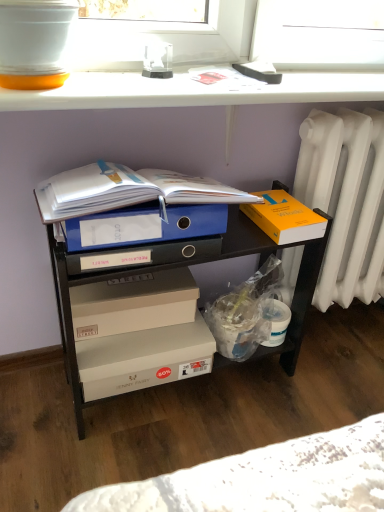
Find the location of a particular element. The width and height of the screenshot is (384, 512). blue plastic file at center is located at coordinates (137, 156).

What is the approximate height of orange matte book at right, which is the 1th box in top-to-bottom order?

orange matte book at right, which is the 1th box in top-to-bottom order, is 2.44 inches tall.

Find the location of a particular element. The height and width of the screenshot is (512, 384). white glossy window sill at upper center is located at coordinates (193, 91).

Is the depth of beige cardboard box at center, the second box from the top, greater than that of white plastic radiator at right?

Yes, beige cardboard box at center, the second box from the top, is further from the viewer.

From the image's perspective, which object appears higher, beige cardboard box at center, positioned as the 2th box in bottom-to-top order, or white plastic radiator at right?

white plastic radiator at right.

Considering the sizes of objects beige cardboard box at center, the second box from the top, and white plastic radiator at right in the image provided, who is bigger, beige cardboard box at center, the second box from the top, or white plastic radiator at right?

With larger size is white plastic radiator at right.

Where is `radiator located in front of the beige cardboard box at center, positioned as the 2th box in bottom-to-top order`? radiator located in front of the beige cardboard box at center, positioned as the 2th box in bottom-to-top order is located at coordinates point(346,200).

Is orange matte book at right, the third box positioned from the bottom, at the left side of beige cardboard box at center, the second box from the top?

In fact, orange matte book at right, the third box positioned from the bottom, is to the right of beige cardboard box at center, the second box from the top.

Considering the points (286, 206) and (173, 305), which point is behind, point (286, 206) or point (173, 305)?

The point (286, 206) is behind.

Identify the location of box above the beige cardboard box at center, positioned as the 2th box in bottom-to-top order (from the image's perspective). 285,218.

From a real-world perspective, is orange matte book at right, the third box positioned from the bottom, positioned over beige cardboard box at center, the second box from the top, based on gravity?

Yes, from a real-world perspective, orange matte book at right, the third box positioned from the bottom, is on top of beige cardboard box at center, the second box from the top.

Does white plastic radiator at right appear on the right side of white cardboard box at center, which is the third box from top to bottom?

Correct, you'll find white plastic radiator at right to the right of white cardboard box at center, which is the third box from top to bottom.

Is white plastic radiator at right touching white cardboard box at center, which is the third box from top to bottom?

No.

Between white plastic radiator at right and white cardboard box at center, which appears as the first box when ordered from the bottom, which one has less height?

With less height is white cardboard box at center, which appears as the first box when ordered from the bottom.

Is point (318, 221) closer to camera compared to point (116, 394)?

That is True.

Is orange matte book at right, which is the 1th box in top-to-bottom order, facing away from white cardboard box at center, which is the third box from top to bottom?

No, white cardboard box at center, which is the third box from top to bottom, is not at the back of orange matte book at right, which is the 1th box in top-to-bottom order.

Between orange matte book at right, the third box positioned from the bottom, and white cardboard box at center, which is the third box from top to bottom, which one has larger size?

white cardboard box at center, which is the third box from top to bottom, is bigger.

Between orange matte book at right, the third box positioned from the bottom, and white cardboard box at center, which appears as the first box when ordered from the bottom, which one has less height?

orange matte book at right, the third box positioned from the bottom, is shorter.

Based on the photo, which is farther from the camera, (37, 252) or (293, 217)?

The point (37, 252) is farther from the camera.

Between blue plastic file at center and orange matte book at right, which is the 1th box in top-to-bottom order, which one is positioned in front?

blue plastic file at center.

Do you think blue plastic file at center is within orange matte book at right, which is the 1th box in top-to-bottom order, or outside of it?

blue plastic file at center is spatially situated outside orange matte book at right, which is the 1th box in top-to-bottom order.

Looking at their sizes, would you say blue plastic file at center is wider or thinner than orange matte book at right, which is the 1th box in top-to-bottom order?

In the image, blue plastic file at center appears to be wider than orange matte book at right, which is the 1th box in top-to-bottom order.

From the image's perspective, which is above, white plastic radiator at right or orange matte book at right, which is the 1th box in top-to-bottom order?

orange matte book at right, which is the 1th box in top-to-bottom order.

Relative to orange matte book at right, which is the 1th box in top-to-bottom order, is white plastic radiator at right in front or behind?

white plastic radiator at right is behind orange matte book at right, which is the 1th box in top-to-bottom order.

How distant is white plastic radiator at right from orange matte book at right, the third box positioned from the bottom?

The distance of white plastic radiator at right from orange matte book at right, the third box positioned from the bottom, is 8.18 inches.

Is white plastic radiator at right spatially inside orange matte book at right, the third box positioned from the bottom, or outside of it?

white plastic radiator at right is located beyond the bounds of orange matte book at right, the third box positioned from the bottom.

Would you consider white cardboard box at center, which appears as the first box when ordered from the bottom, to be distant from white plastic radiator at right?

No, white cardboard box at center, which appears as the first box when ordered from the bottom, is in close proximity to white plastic radiator at right.

In terms of size, does white cardboard box at center, which is the third box from top to bottom, appear bigger or smaller than white plastic radiator at right?

In the image, white cardboard box at center, which is the third box from top to bottom, appears to be smaller than white plastic radiator at right.

From the image's perspective, which one is positioned higher, white cardboard box at center, which is the third box from top to bottom, or white plastic radiator at right?

white plastic radiator at right is shown above in the image.

Which point is more forward, (159, 376) or (301, 165)?

The point (159, 376) is closer to the camera.

You are a GUI agent. You are given a task and a screenshot of the screen. Output one action in this format:
    pyautogui.click(x=<x>, y=<y>)
    Task: Click on the radiator in front of the beige cardboard box at center, the second box from the top
    The image size is (384, 512).
    Given the screenshot: What is the action you would take?
    pyautogui.click(x=346, y=200)

Identify the location of box that is behind the orange matte book at right, which is the 1th box in top-to-bottom order. This screenshot has width=384, height=512. (133, 303).

From the image, which object appears to be nearer to white cardboard box at center, which appears as the first box when ordered from the bottom, white plastic radiator at right or beige cardboard box at center, positioned as the 2th box in bottom-to-top order?

Among the two, beige cardboard box at center, positioned as the 2th box in bottom-to-top order, is located nearer to white cardboard box at center, which appears as the first box when ordered from the bottom.

Considering their positions, is white glossy window sill at upper center positioned closer to white plastic radiator at right than blue plastic file at center?

blue plastic file at center is closer to white plastic radiator at right.

Based on their spatial positions, is white plastic radiator at right or orange matte book at right, which is the 1th box in top-to-bottom order, further from beige cardboard box at center, positioned as the 2th box in bottom-to-top order?

Based on the image, white plastic radiator at right appears to be further to beige cardboard box at center, positioned as the 2th box in bottom-to-top order.

Which object lies nearer to the anchor point white plastic radiator at right, blue plastic file at center or white glossy window sill at upper center?

blue plastic file at center is positioned closer to the anchor white plastic radiator at right.

Based on their spatial positions, is white glossy window sill at upper center or white plastic radiator at right closer to beige cardboard box at center, positioned as the 2th box in bottom-to-top order?

white glossy window sill at upper center is closer to beige cardboard box at center, positioned as the 2th box in bottom-to-top order.

From the image, which object appears to be farther from beige cardboard box at center, the second box from the top, white cardboard box at center, which appears as the first box when ordered from the bottom, or blue plastic file at center?

blue plastic file at center is further to beige cardboard box at center, the second box from the top.

Based on their spatial positions, is white glossy window sill at upper center or white plastic radiator at right further from white cardboard box at center, which appears as the first box when ordered from the bottom?

The object further to white cardboard box at center, which appears as the first box when ordered from the bottom, is white glossy window sill at upper center.

Based on their spatial positions, is beige cardboard box at center, the second box from the top, or white glossy window sill at upper center further from blue plastic file at center?

beige cardboard box at center, the second box from the top, lies further to blue plastic file at center than the other object.

Locate an element on the screen. Image resolution: width=384 pixels, height=512 pixels. window sill between white cardboard box at center, which appears as the first box when ordered from the bottom, and white plastic radiator at right, in the horizontal direction is located at coordinates coord(193,91).

Locate an element on the screen. Image resolution: width=384 pixels, height=512 pixels. desk between white cardboard box at center, which is the third box from top to bottom, and white plastic radiator at right, in the horizontal direction is located at coordinates (137, 156).

Locate an element on the screen. Image resolution: width=384 pixels, height=512 pixels. box between blue plastic file at center and white plastic radiator at right in the horizontal direction is located at coordinates (285, 218).

At what (x,y) coordinates should I click in order to perform the action: click on desk between white cardboard box at center, which appears as the first box when ordered from the bottom, and orange matte book at right, which is the 1th box in top-to-bottom order, in the horizontal direction. Please return your answer as a coordinate pair (x, y). The height and width of the screenshot is (512, 384). Looking at the image, I should click on (137, 156).